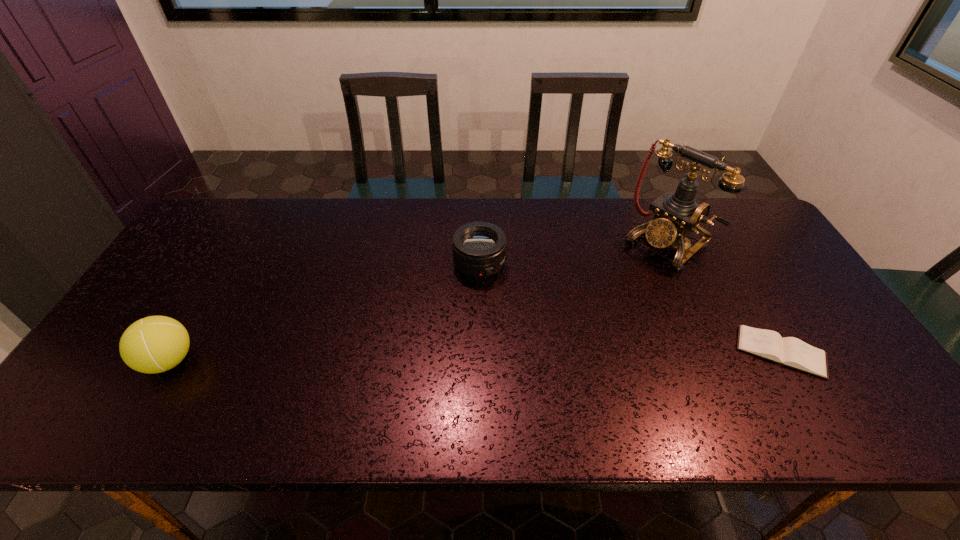
Find the location of a particular element. This screenshot has width=960, height=540. free space on the desktop that is between the third shortest object and the shortest object and is positioned on the front of the tallest object, featuring the rotary dial is located at coordinates (531, 355).

Find the location of a particular element. Image resolution: width=960 pixels, height=540 pixels. vacant spot on the desktop that is between the leftmost object and the shortest object and is positioned on the side of the second shortest object with brand markings and control switches is located at coordinates (555, 355).